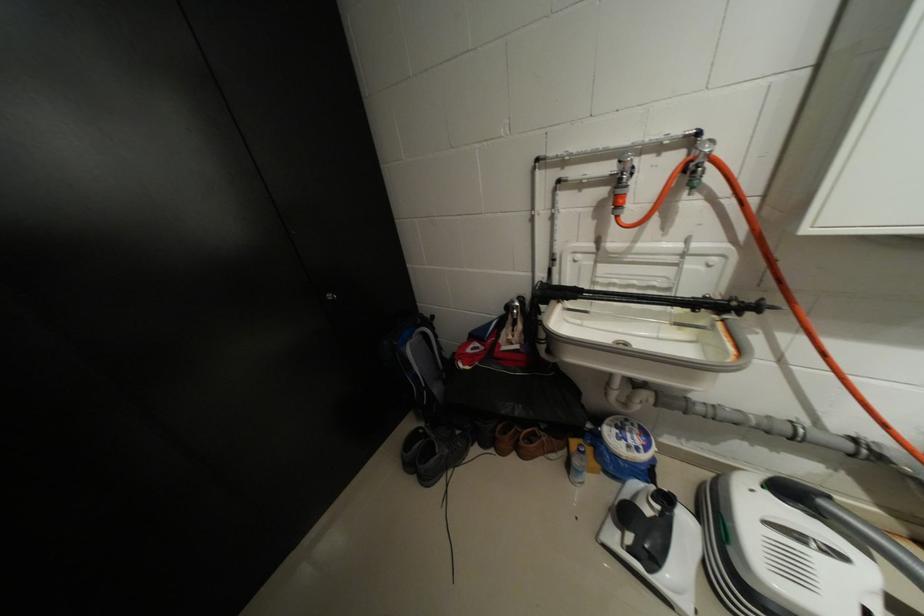
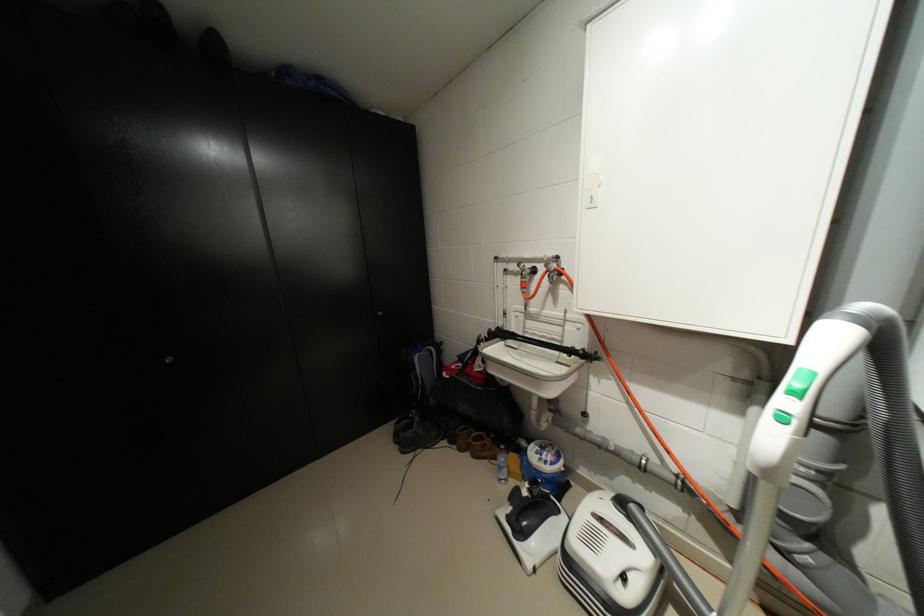
What movement of the cameraman would produce the second image?

The cameraman moved toward right, backward.